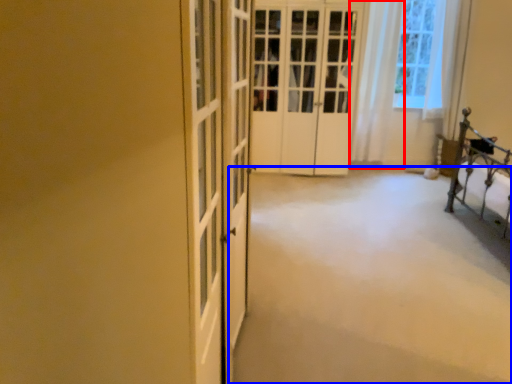
Question: Among these objects, which one is nearest to the camera, curtain (highlighted by a red box) or plain (highlighted by a blue box)?

Choices:
 (A) curtain
 (B) plain

Answer: (B)